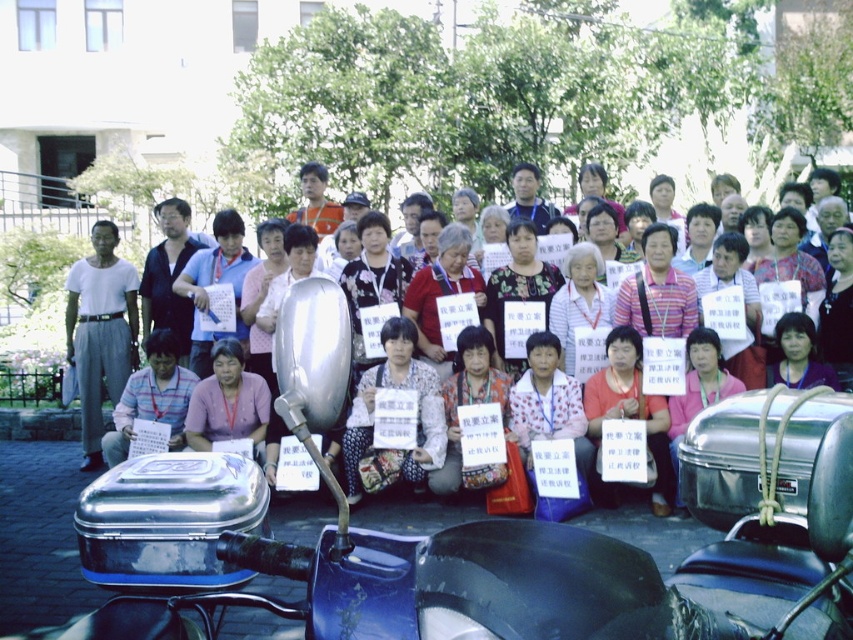
Question: Can you confirm if silver metallic helmet at center is thinner than matte black sign at center?

Choices:
 (A) no
 (B) yes

Answer: (A)

Question: Which point is farther to the camera?

Choices:
 (A) (384, 381)
 (B) (108, 257)
 (C) (250, 435)
 (D) (585, 273)

Answer: (B)

Question: Based on their relative distances, which object is farther from the silver metallic helmet at center?

Choices:
 (A) pink fabric shirt at center
 (B) white cotton shirt at left
 (C) matte black sign at center

Answer: (B)

Question: Does white cotton shirt at left appear under pink fabric shirt at center?

Choices:
 (A) no
 (B) yes

Answer: (A)

Question: Which object is the closest to the pink fabric shirt at center?

Choices:
 (A) white cotton shirt at left
 (B) silver metallic helmet at center
 (C) matte black sign at center

Answer: (C)

Question: From the image, what is the correct spatial relationship of white cotton shirt at left in relation to matte black sign at center?

Choices:
 (A) below
 (B) above

Answer: (B)